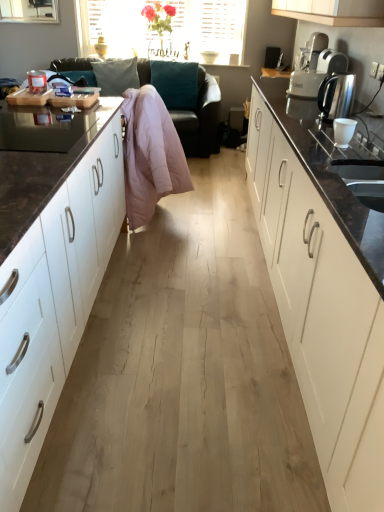
Question: Considering their positions, is white matte cabinet at left, placed as the 1th cabinetry when sorted from left to right, located in front of or behind white plastic toaster at upper right?

Choices:
 (A) front
 (B) behind

Answer: (A)

Question: Do you think white matte cabinet at left, which ranks as the 2th cabinetry in right-to-left order, is within white plastic toaster at upper right, or outside of it?

Choices:
 (A) outside
 (B) inside

Answer: (A)

Question: Which of these objects is positioned farthest from the white plastic toaster at upper right?

Choices:
 (A) pink down jacket at center
 (B) transparent glass window at upper left
 (C) translucent glass vase at upper center
 (D) white matte cabinet at left, placed as the 1th cabinetry when sorted from left to right
 (E) teal fabric pillow at upper center

Answer: (B)

Question: Based on their relative distances, which object is nearer to the pink fabric couch at center?

Choices:
 (A) white glossy cabinet at right, the 2th cabinetry in the left-to-right sequence
 (B) transparent glass window at upper left
 (C) satin silver kettle at right
 (D) teal fabric pillow at upper center
 (E) translucent glass vase at upper center

Answer: (D)